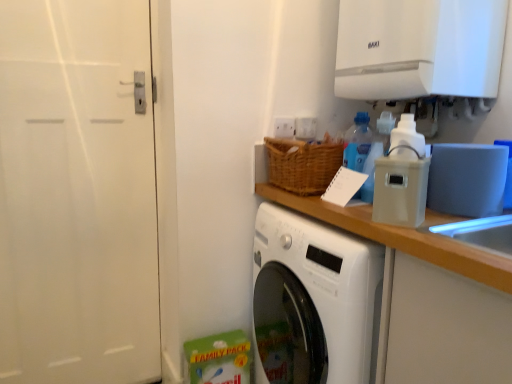
Question: Does white matte door at left have a smaller size compared to white glossy exhaust hood at upper right?

Choices:
 (A) yes
 (B) no

Answer: (A)

Question: Is white matte door at left shorter than white glossy exhaust hood at upper right?

Choices:
 (A) no
 (B) yes

Answer: (A)

Question: Is white matte door at left positioned in front of white glossy exhaust hood at upper right?

Choices:
 (A) no
 (B) yes

Answer: (A)

Question: Is white matte door at left touching white glossy exhaust hood at upper right?

Choices:
 (A) no
 (B) yes

Answer: (A)

Question: Does white matte door at left have a lesser width compared to white glossy exhaust hood at upper right?

Choices:
 (A) yes
 (B) no

Answer: (A)

Question: Is blue translucent bottle at upper right, marked as the first bottle in a left-to-right arrangement, in front of or behind translucent plastic soap dispenser at upper right, placed as the 1th bottle when sorted from right to left, in the image?

Choices:
 (A) behind
 (B) front

Answer: (A)

Question: Is point (360, 122) closer or farther from the camera than point (384, 122)?

Choices:
 (A) farther
 (B) closer

Answer: (A)

Question: From the image's perspective, relative to translucent plastic soap dispenser at upper right, placed as the 1th bottle when sorted from right to left, is blue translucent bottle at upper right, which appears as the 2th bottle when viewed from the right, above or below?

Choices:
 (A) below
 (B) above

Answer: (B)

Question: Based on their sizes in the image, would you say blue translucent bottle at upper right, marked as the first bottle in a left-to-right arrangement, is bigger or smaller than translucent plastic soap dispenser at upper right, placed as the 1th bottle when sorted from right to left?

Choices:
 (A) big
 (B) small

Answer: (B)

Question: Considering the positions of white matte door at left and white glossy exhaust hood at upper right in the image, is white matte door at left taller or shorter than white glossy exhaust hood at upper right?

Choices:
 (A) tall
 (B) short

Answer: (A)

Question: Is white matte door at left bigger or smaller than white glossy exhaust hood at upper right?

Choices:
 (A) big
 (B) small

Answer: (B)

Question: Considering the relative positions of white matte door at left and white glossy exhaust hood at upper right in the image provided, is white matte door at left to the left or to the right of white glossy exhaust hood at upper right?

Choices:
 (A) right
 (B) left

Answer: (B)

Question: Considering the positions of point (158, 354) and point (448, 34), is point (158, 354) closer or farther from the camera than point (448, 34)?

Choices:
 (A) closer
 (B) farther

Answer: (B)

Question: In terms of width, does white matte door at left look wider or thinner when compared to translucent plastic soap dispenser at upper right, placed as the 1th bottle when sorted from right to left?

Choices:
 (A) thin
 (B) wide

Answer: (A)

Question: From a real-world perspective, is white matte door at left above or below translucent plastic soap dispenser at upper right, placed as the 1th bottle when sorted from right to left?

Choices:
 (A) below
 (B) above

Answer: (A)